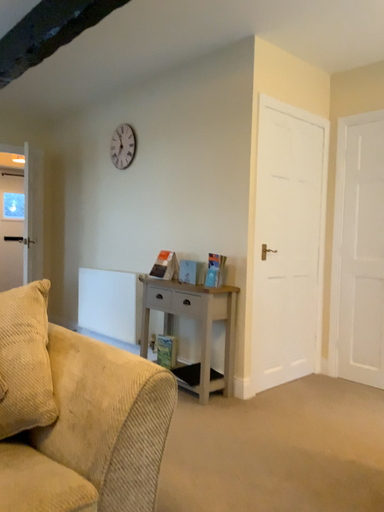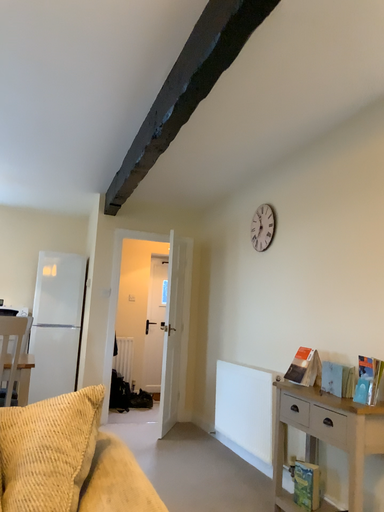
Question: How did the camera likely rotate when shooting the video?

Choices:
 (A) rotated upward
 (B) rotated downward

Answer: (A)